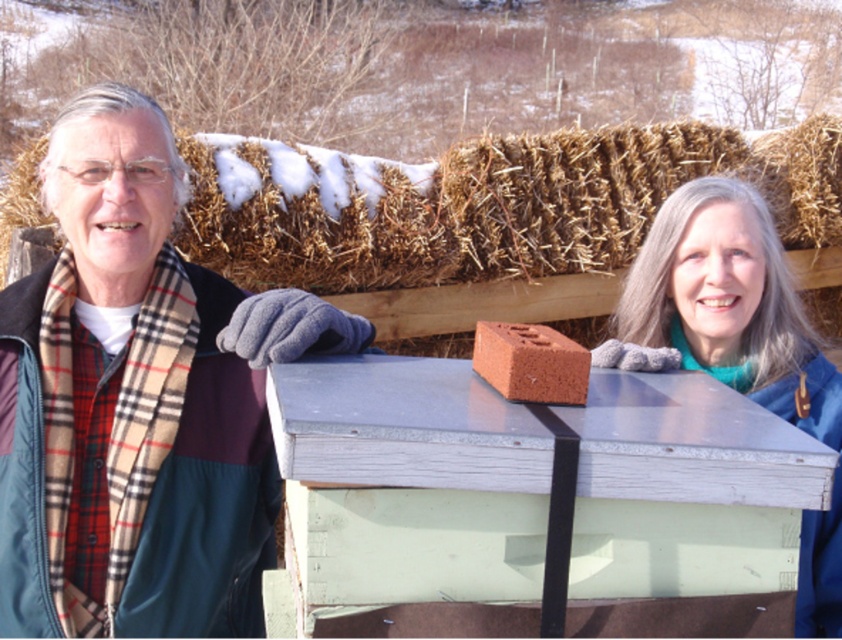
Question: Which point appears closest to the camera in this image?

Choices:
 (A) (328, 497)
 (B) (569, 396)
 (C) (153, 356)

Answer: (A)

Question: Does plaid scarf at left appear over red clay brick at center?

Choices:
 (A) no
 (B) yes

Answer: (A)

Question: Which of the following is the closest to the observer?

Choices:
 (A) blue fabric at upper right
 (B) smooth gray wood crate at center

Answer: (B)

Question: Is plaid scarf at left to the left of blue fabric at upper right from the viewer's perspective?

Choices:
 (A) no
 (B) yes

Answer: (B)

Question: Can you confirm if smooth gray wood crate at center is thinner than brown straw bale at upper center?

Choices:
 (A) no
 (B) yes

Answer: (B)

Question: Which point is closer to the camera?

Choices:
 (A) red clay brick at center
 (B) smooth gray wood crate at center
 (C) plaid scarf at left

Answer: (B)